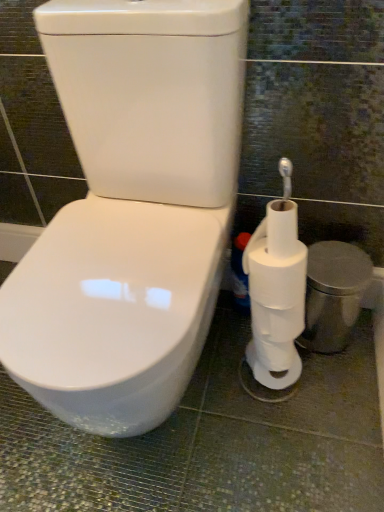
Image resolution: width=384 pixels, height=512 pixels. Describe the element at coordinates (240, 273) in the screenshot. I see `white plastic bottle at lower right` at that location.

The height and width of the screenshot is (512, 384). I want to click on white plastic bottle at lower right, so click(x=240, y=273).

This screenshot has width=384, height=512. In order to click on white matte toilet paper at right in this screenshot , I will do `click(276, 275)`.

What do you see at coordinates (276, 275) in the screenshot? This screenshot has width=384, height=512. I see `white matte toilet paper at right` at bounding box center [276, 275].

Image resolution: width=384 pixels, height=512 pixels. Identify the location of white plastic bottle at lower right. (240, 273).

Which is more to the right, white matte toilet paper at right or white plastic bottle at lower right?

white matte toilet paper at right.

Between white matte toilet paper at right and white plastic bottle at lower right, which one is positioned in front?

white matte toilet paper at right.

Between point (262, 301) and point (241, 272), which one is positioned in front?

Point (262, 301)

From the image's perspective, relative to white plastic bottle at lower right, is white matte toilet paper at right above or below?

From the image's perspective, white matte toilet paper at right appears above white plastic bottle at lower right.

From a real-world perspective, who is located lower, white matte toilet paper at right or white plastic bottle at lower right?

white plastic bottle at lower right is physically lower.

Between white matte toilet paper at right and white plastic bottle at lower right, which one has smaller width?

Thinner between the two is white plastic bottle at lower right.

Can you confirm if white matte toilet paper at right is shorter than white plastic bottle at lower right?

Indeed, white matte toilet paper at right has a lesser height compared to white plastic bottle at lower right.

Looking at the image, does white matte toilet paper at right seem bigger or smaller compared to white plastic bottle at lower right?

white matte toilet paper at right is bigger than white plastic bottle at lower right.

Could white plastic bottle at lower right be considered to be inside white matte toilet paper at right?

Definitely not — white plastic bottle at lower right is not inside white matte toilet paper at right.

Is white matte toilet paper at right not close to white plastic bottle at lower right?

No, there isn't a large distance between white matte toilet paper at right and white plastic bottle at lower right.

Is white matte toilet paper at right aimed at white plastic bottle at lower right?

No, white matte toilet paper at right is not turned towards white plastic bottle at lower right.

How different are the orientations of white matte toilet paper at right and white plastic bottle at lower right in degrees?

They differ by 90.8 degrees in their facing directions.

How much distance is there between white matte toilet paper at right and white plastic bottle at lower right?

They are 5.36 inches apart.

Locate an element on the screen. The image size is (384, 512). cleaning product behind the white matte toilet paper at right is located at coordinates (240, 273).

Considering the relative positions of white plastic bottle at lower right and white matte toilet paper at right in the image provided, is white plastic bottle at lower right to the left of white matte toilet paper at right from the viewer's perspective?

Indeed, white plastic bottle at lower right is positioned on the left side of white matte toilet paper at right.

Considering the positions of objects white plastic bottle at lower right and white matte toilet paper at right in the image provided, who is in front, white plastic bottle at lower right or white matte toilet paper at right?

white matte toilet paper at right is in front.

Which is in front, point (232, 243) or point (270, 293)?

Positioned in front is point (270, 293).

From the image's perspective, is white plastic bottle at lower right located above or below white matte toilet paper at right?

From the image's perspective, white plastic bottle at lower right appears below white matte toilet paper at right.

From a real-world perspective, is white plastic bottle at lower right physically located above or below white matte toilet paper at right?

white plastic bottle at lower right is below white matte toilet paper at right.

Between white plastic bottle at lower right and white matte toilet paper at right, which one has larger width?

white matte toilet paper at right is wider.

Consider the image. Which of these two, white plastic bottle at lower right or white matte toilet paper at right, stands shorter?

white matte toilet paper at right.

Is white plastic bottle at lower right bigger than white matte toilet paper at right?

No.

From the picture: Is white matte toilet paper at right located within white plastic bottle at lower right?

Actually, white matte toilet paper at right is outside white plastic bottle at lower right.

Would you consider white plastic bottle at lower right to be distant from white matte toilet paper at right?

Actually, white plastic bottle at lower right and white matte toilet paper at right are a little close together.

Is white plastic bottle at lower right positioned with its back to white matte toilet paper at right?

white plastic bottle at lower right is not turned away from white matte toilet paper at right.

The width and height of the screenshot is (384, 512). In order to click on cleaning product behind the white matte toilet paper at right in this screenshot , I will do pyautogui.click(x=240, y=273).

The image size is (384, 512). Identify the location of toilet paper in front of the white plastic bottle at lower right. (276, 275).

The width and height of the screenshot is (384, 512). I want to click on cleaning product on the left of white matte toilet paper at right, so click(240, 273).